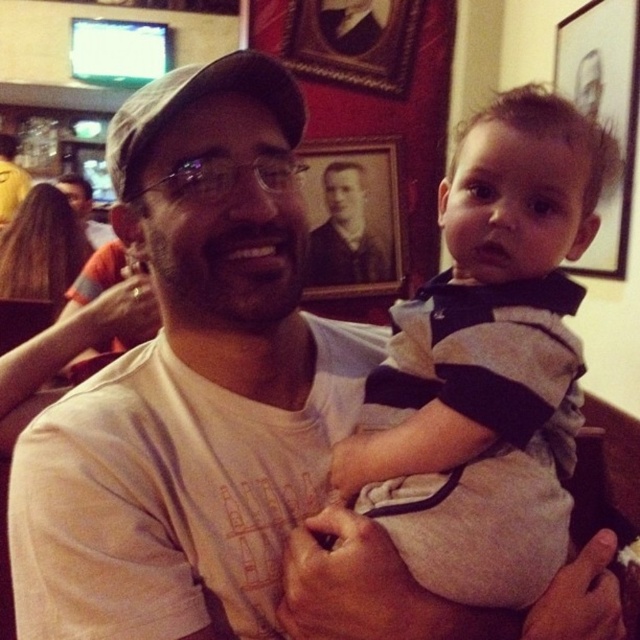
Does striped cotton shirt at center appear on the right side of black matte picture frame at upper center?

Indeed, striped cotton shirt at center is positioned on the right side of black matte picture frame at upper center.

Identify the location of striped cotton shirt at center. The height and width of the screenshot is (640, 640). (486, 364).

Does point (492, 484) come farther from viewer compared to point (324, 259)?

No.

This screenshot has height=640, width=640. What are the coordinates of `striped cotton shirt at center` in the screenshot? It's located at (486, 364).

Measure the distance between black matte picture frame at upper right and camera.

black matte picture frame at upper right is 1.88 meters away from camera.

Is point (584, 83) farther from viewer compared to point (97, 221)?

No, it is in front of (97, 221).

What do you see at coordinates (604, 109) in the screenshot?
I see `black matte picture frame at upper right` at bounding box center [604, 109].

Image resolution: width=640 pixels, height=640 pixels. I want to click on black matte picture frame at upper right, so click(604, 109).

Does striped cotton shirt at center have a larger size compared to matte white shirt at center?

Actually, striped cotton shirt at center might be smaller than matte white shirt at center.

Between striped cotton shirt at center and matte white shirt at center, which one is positioned higher?

matte white shirt at center

Does point (531, 342) lie in front of point (68, 193)?

That is True.

Identify the location of striped cotton shirt at center. (486, 364).